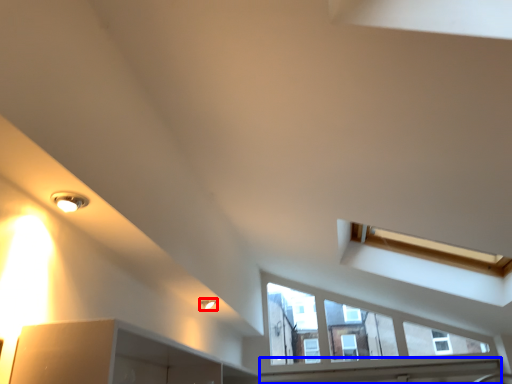
Question: Which point is closer to the camera, light fixture (highlighted by a red box) or window sill (highlighted by a blue box)?

Choices:
 (A) light fixture
 (B) window sill

Answer: (A)